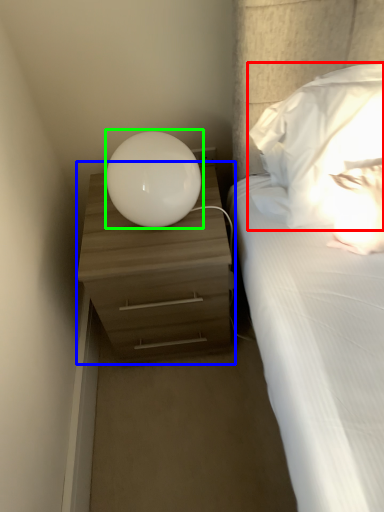
Question: Which object is positioned closest to pillow (highlighted by a red box)? Select from nightstand (highlighted by a blue box) and table lamp (highlighted by a green box).

Choices:
 (A) nightstand
 (B) table lamp

Answer: (B)